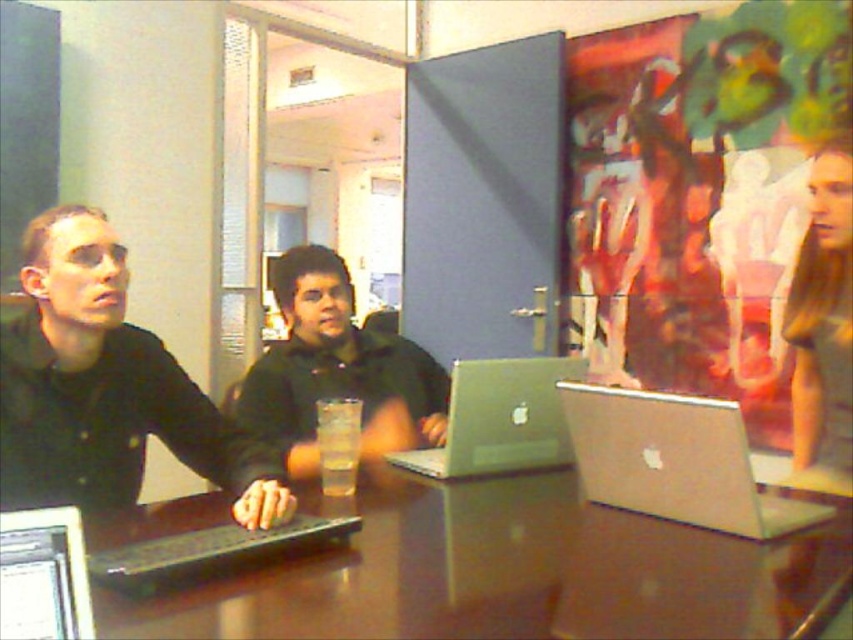
Is black matte shirt at center shorter than clear plastic cup at center?

Incorrect, black matte shirt at center's height does not fall short of clear plastic cup at center's.

Who is positioned more to the right, black matte shirt at center or clear plastic cup at center?

clear plastic cup at center is more to the right.

The width and height of the screenshot is (853, 640). What do you see at coordinates (337, 369) in the screenshot?
I see `black matte shirt at center` at bounding box center [337, 369].

In order to click on black matte shirt at center in this screenshot , I will do `click(337, 369)`.

Who is more distant from viewer, (55, 586) or (262, 536)?

Positioned behind is point (262, 536).

Is point (47, 548) less distant than point (254, 536)?

Yes, it is in front of point (254, 536).

Who is more forward, (83, 566) or (299, 548)?

Point (83, 566) is in front.

Where is `white glossy monitor at lower left`? Image resolution: width=853 pixels, height=640 pixels. white glossy monitor at lower left is located at coordinates (44, 576).

Can you confirm if silver metallic laptop at right is smaller than white glossy monitor at lower left?

Incorrect, silver metallic laptop at right is not smaller in size than white glossy monitor at lower left.

Which is in front, point (646, 481) or point (18, 595)?

Positioned in front is point (18, 595).

Between point (581, 458) and point (9, 636), which one is positioned behind?

The point (581, 458) is behind.

I want to click on silver metallic laptop at right, so click(x=675, y=461).